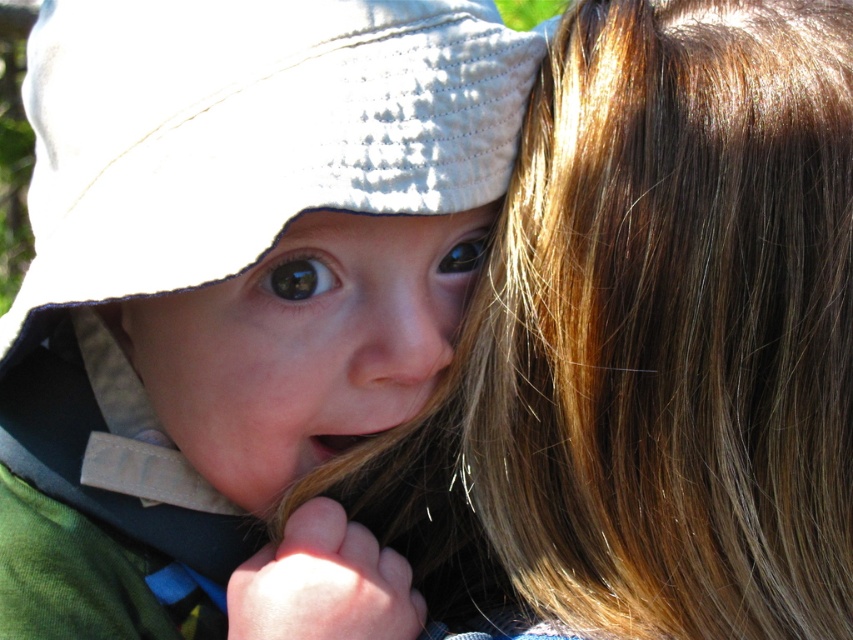
You are a photographer trying to capture a candid shot of the child and the person holding their hat. Given the distance between the matte white hat at upper left and the smooth brown hair at upper right, can you estimate if the two subjects are close enough to be in the same frame without zooming?

The matte white hat at upper left and the smooth brown hair at upper right are 11.20 centimeters apart from each other. Since this distance is relatively small, they can likely be captured in the same frame without needing to zoom.

You are a photographer adjusting the focus on your camera. You want to ensure both the matte white hat at upper left and the glossy blue eye at center are in focus. Given that your camera has a depth of field that can cover 6 inches, will both subjects be in focus?

The distance between the matte white hat at upper left and the glossy blue eye at center is 7.04 inches. Since the depth of field only covers 6 inches, both subjects cannot be in focus simultaneously.

Looking at the scene, which object is positioned to the left of the other between the matte white hat at upper left and the glossy blue eye at center?

The matte white hat at upper left is positioned to the left of the glossy blue eye at center according to the description.